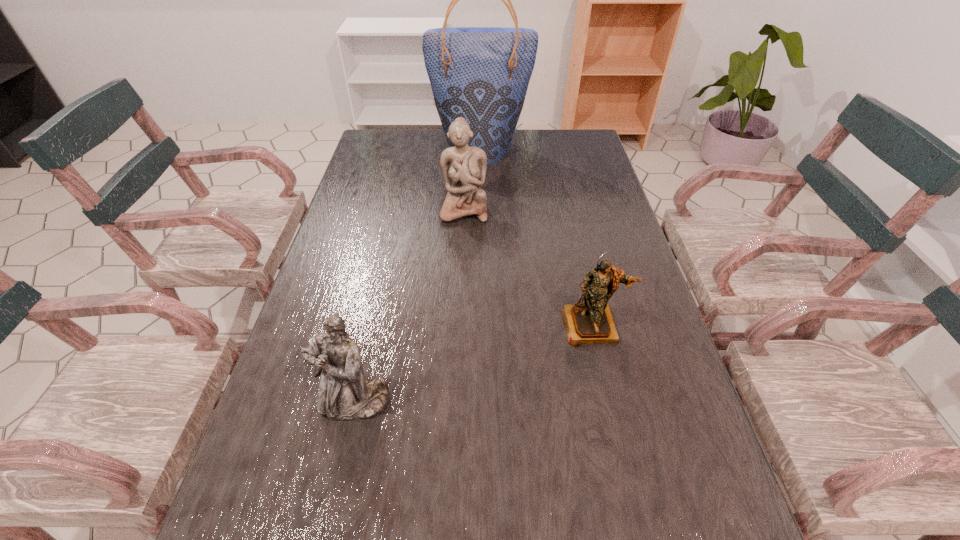
Identify the location of vacant area located on the front-facing side of the leftmost figurine. Image resolution: width=960 pixels, height=540 pixels. (329, 514).

This screenshot has width=960, height=540. I want to click on vacant area located 0.250m on the front-facing side of the second nearest object, so click(623, 462).

At what (x,y) coordinates should I click in order to perform the action: click on object present at the far edge. Please return your answer as a coordinate pair (x, y). Image resolution: width=960 pixels, height=540 pixels. Looking at the image, I should click on (482, 74).

Locate an element on the screen. object at the left edge is located at coordinates (344, 394).

This screenshot has width=960, height=540. I want to click on object that is at the right edge, so click(x=590, y=321).

Where is `vacant point at the far edge`? vacant point at the far edge is located at coordinates (508, 160).

This screenshot has height=540, width=960. In the image, there is a desktop. In order to click on vacant space at the left edge in this screenshot , I will do `click(381, 242)`.

The image size is (960, 540). In the image, there is a desktop. What are the coordinates of `vacant space at the right edge` in the screenshot? It's located at (607, 386).

Find the location of a particular element. blank area at the far right corner is located at coordinates (569, 158).

The height and width of the screenshot is (540, 960). Identify the location of empty location between the shopping bag and the leftmost figurine. (418, 276).